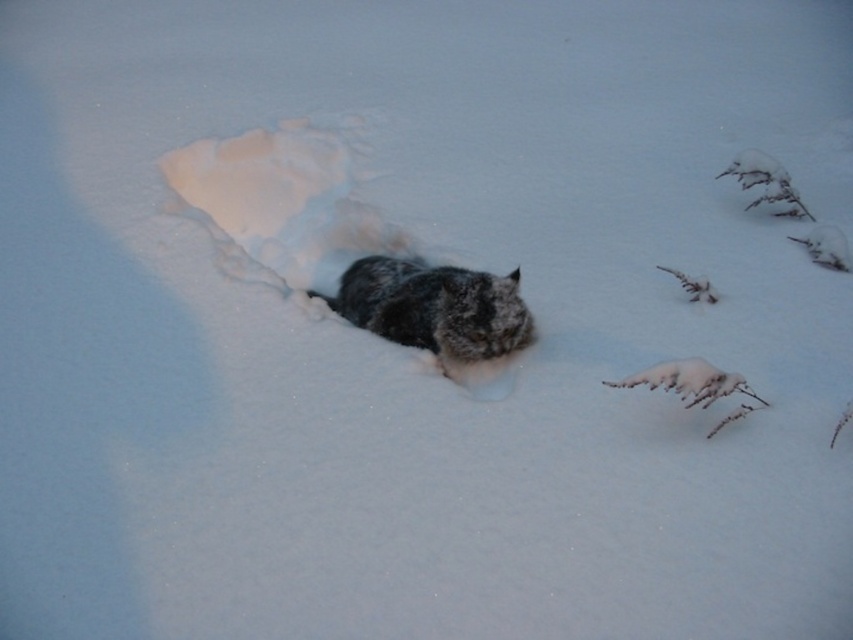
Question: From the image, what is the correct spatial relationship of white fluffy snow at center in relation to fuzzy fur cat at center?

Choices:
 (A) right
 (B) left

Answer: (B)

Question: Can you confirm if white fluffy snow at center is positioned to the right of fuzzy fur cat at center?

Choices:
 (A) no
 (B) yes

Answer: (A)

Question: Which object is closer to the camera taking this photo?

Choices:
 (A) white fluffy snow at center
 (B) fuzzy fur cat at center

Answer: (B)

Question: Is white fluffy snow at center bigger than fuzzy fur cat at center?

Choices:
 (A) no
 (B) yes

Answer: (B)

Question: Among these objects, which one is nearest to the camera?

Choices:
 (A) white fluffy snow at center
 (B) fuzzy fur cat at center

Answer: (B)

Question: Which of the following is the closest to the observer?

Choices:
 (A) (527, 310)
 (B) (271, 246)

Answer: (A)